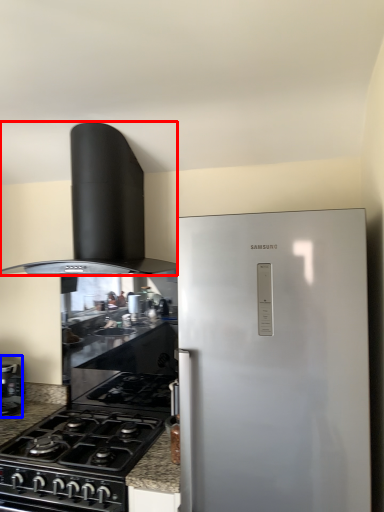
Question: Which point is closer to the camera, home appliance (highlighted by a red box) or kitchen appliance (highlighted by a blue box)?

Choices:
 (A) home appliance
 (B) kitchen appliance

Answer: (A)